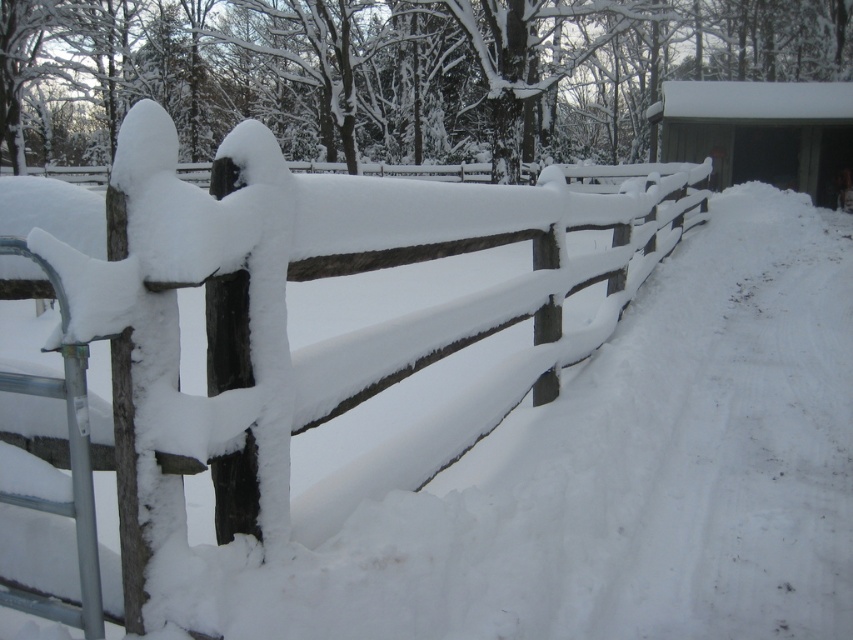
The width and height of the screenshot is (853, 640). I want to click on wooden fence at center, so click(285, 317).

Can you confirm if wooden fence at center is taller than wooden cabin at upper right?

Yes, wooden fence at center is taller than wooden cabin at upper right.

The width and height of the screenshot is (853, 640). Find the location of `wooden fence at center`. wooden fence at center is located at coordinates (285, 317).